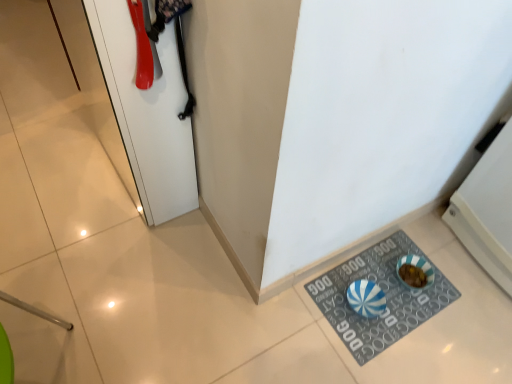
Locate an element on the screen. Image resolution: width=512 pixels, height=384 pixels. free region on the left part of white glossy door at upper left is located at coordinates (55, 161).